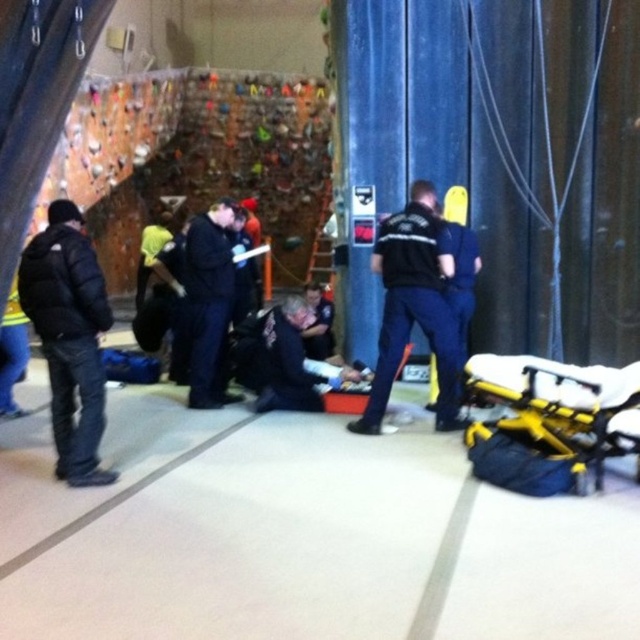
Question: Which is farther from the yellow metallic stretcher at center?

Choices:
 (A) black matte jacket at left
 (B) dark blue uniform at center
 (C) blue uniform at center
 (D) black fabric jacket at center

Answer: (D)

Question: Does black matte jacket at left have a greater width compared to blue uniform at center?

Choices:
 (A) no
 (B) yes

Answer: (B)

Question: From the image, what is the correct spatial relationship of black matte jacket at left in relation to black fabric jacket at center?

Choices:
 (A) right
 (B) left

Answer: (B)

Question: Which of these objects is positioned farthest from the yellow metallic stretcher at center?

Choices:
 (A) blue uniform at center
 (B) black fabric jacket at center
 (C) black matte jacket at left

Answer: (B)

Question: Does dark blue uniform at center appear over black fabric jacket at center?

Choices:
 (A) no
 (B) yes

Answer: (A)

Question: Which point is closer to the camera?

Choices:
 (A) yellow metallic stretcher at center
 (B) dark blue uniform at center
 (C) black fabric jacket at center
 (D) blue uniform at center

Answer: (A)